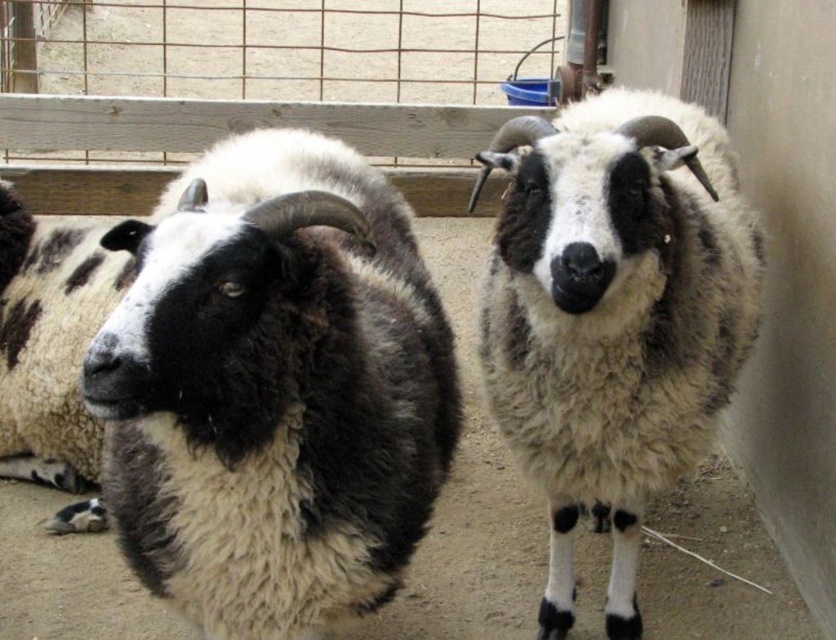
You are a farmer checking the enclosure. You notice two animals at the center of the image. Which one is shorter between the black and white woolen goat at center and the fluffy woolen sheep at center?

The black and white woolen goat at center is shorter than the fluffy woolen sheep at center.

From the picture: You are a farmer checking the sheep in the barn. You notice the black and white woolen goat at center and the fluffy white wool at left. Which one is shorter in height?

The black and white woolen goat at center is shorter compared to the fluffy white wool at left.